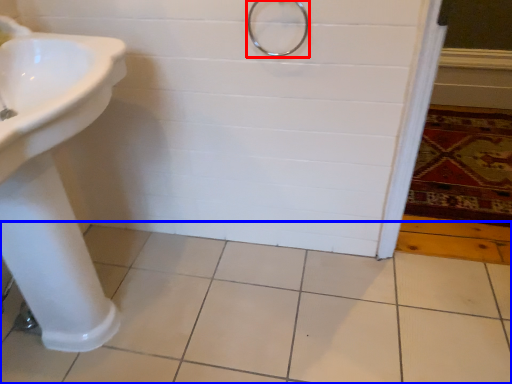
Question: Which of the following is the closest to the observer, shower (highlighted by a red box) or ceramic tile (highlighted by a blue box)?

Choices:
 (A) shower
 (B) ceramic tile

Answer: (B)